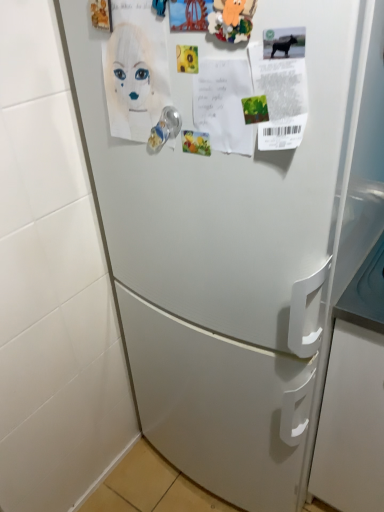
Question: Based on their sizes in the image, would you say white paper at upper left is bigger or smaller than clear plastic door handle at center?

Choices:
 (A) big
 (B) small

Answer: (A)

Question: Would you say white paper at upper left is to the left or to the right of clear plastic door handle at center in the picture?

Choices:
 (A) left
 (B) right

Answer: (A)

Question: From the image's perspective, is white paper at upper left located above or below clear plastic door handle at center?

Choices:
 (A) below
 (B) above

Answer: (B)

Question: In terms of height, does clear plastic door handle at center look taller or shorter compared to white paper at upper left?

Choices:
 (A) short
 (B) tall

Answer: (A)

Question: Looking at their shapes, would you say clear plastic door handle at center is wider or thinner than white paper at upper left?

Choices:
 (A) thin
 (B) wide

Answer: (A)

Question: From the image's perspective, is clear plastic door handle at center located above or below white paper at upper left?

Choices:
 (A) above
 (B) below

Answer: (B)

Question: From a real-world perspective, is clear plastic door handle at center above or below white paper at upper left?

Choices:
 (A) above
 (B) below

Answer: (B)